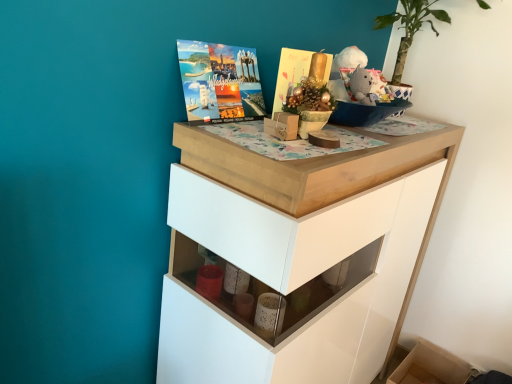
Question: From a real-world perspective, is bare wood drawer at lower right above or below matte brown box at center?

Choices:
 (A) below
 (B) above

Answer: (A)

Question: In the image, is bare wood drawer at lower right positioned in front of or behind matte brown box at center?

Choices:
 (A) behind
 (B) front

Answer: (A)

Question: Which is nearer to the matte brown box at center?

Choices:
 (A) knitted gray bear at upper right
 (B) white glossy chest of drawers at upper center
 (C) bare wood drawer at lower right
 (D) matte gold magazine at upper center

Answer: (D)

Question: Which is nearer to the matte brown box at center?

Choices:
 (A) matte gold magazine at upper center
 (B) white glossy chest of drawers at upper center
 (C) knitted gray bear at upper right
 (D) bare wood drawer at lower right

Answer: (A)